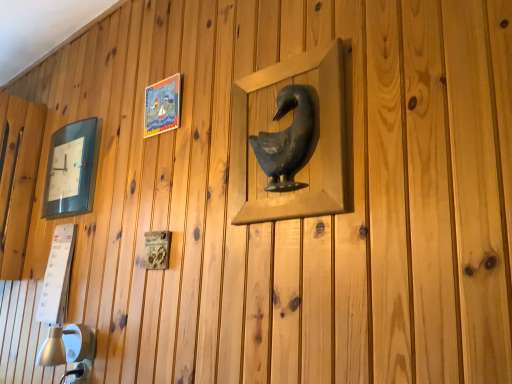
Question: Is there a large distance between metallic gray bird at center, the first picture frame when ordered from right to left, and matte black clock at left, the 1th picture frame when ordered from left to right?

Choices:
 (A) no
 (B) yes

Answer: (A)

Question: Is metallic gray bird at center, arranged as the 3th picture frame when viewed from the back, not within matte black clock at left, the first picture frame from the back?

Choices:
 (A) yes
 (B) no

Answer: (A)

Question: Is matte black clock at left, the 3th picture frame when ordered from right to left, a part of metallic gray bird at center, the first picture frame when ordered from right to left?

Choices:
 (A) yes
 (B) no

Answer: (B)

Question: Considering the relative positions of metallic gray bird at center, arranged as the 3th picture frame when viewed from the back, and matte black clock at left, placed as the third picture frame when sorted from front to back, in the image provided, is metallic gray bird at center, arranged as the 3th picture frame when viewed from the back, to the right of matte black clock at left, placed as the third picture frame when sorted from front to back, from the viewer's perspective?

Choices:
 (A) yes
 (B) no

Answer: (A)

Question: Does metallic gray bird at center, the first picture frame when ordered from right to left, have a lesser width compared to matte black clock at left, placed as the third picture frame when sorted from front to back?

Choices:
 (A) no
 (B) yes

Answer: (B)

Question: From the image's perspective, would you say metallic gray bird at center, which is the third picture frame from left to right, is shown under matte black clock at left, the 3th picture frame when ordered from right to left?

Choices:
 (A) yes
 (B) no

Answer: (B)

Question: Is matte plastic picture frame at upper left, the 2th picture frame when ordered from left to right, not inside metallic gray bird at center, the first picture frame in the front-to-back sequence?

Choices:
 (A) yes
 (B) no

Answer: (A)

Question: Is matte plastic picture frame at upper left, the second picture frame when ordered from front to back, positioned with its back to metallic gray bird at center, the first picture frame in the front-to-back sequence?

Choices:
 (A) yes
 (B) no

Answer: (B)

Question: Does matte plastic picture frame at upper left, the 2th picture frame when ordered from back to front, lie in front of metallic gray bird at center, the first picture frame when ordered from right to left?

Choices:
 (A) no
 (B) yes

Answer: (A)

Question: Considering the relative sizes of matte plastic picture frame at upper left, marked as the 2th picture frame in a right-to-left arrangement, and metallic gray bird at center, which is the third picture frame from left to right, in the image provided, is matte plastic picture frame at upper left, marked as the 2th picture frame in a right-to-left arrangement, bigger than metallic gray bird at center, which is the third picture frame from left to right,?

Choices:
 (A) no
 (B) yes

Answer: (A)

Question: From a real-world perspective, is matte plastic picture frame at upper left, the 2th picture frame when ordered from left to right, beneath metallic gray bird at center, the first picture frame in the front-to-back sequence?

Choices:
 (A) no
 (B) yes

Answer: (A)

Question: From a real-world perspective, is matte plastic picture frame at upper left, the 2th picture frame when ordered from back to front, on metallic gray bird at center, which is the third picture frame from left to right?

Choices:
 (A) no
 (B) yes

Answer: (B)

Question: Considering the relative sizes of matte black clock at left, placed as the third picture frame when sorted from front to back, and matte plastic picture frame at upper left, the 2th picture frame when ordered from left to right, in the image provided, is matte black clock at left, placed as the third picture frame when sorted from front to back, wider than matte plastic picture frame at upper left, the 2th picture frame when ordered from left to right,?

Choices:
 (A) no
 (B) yes

Answer: (B)